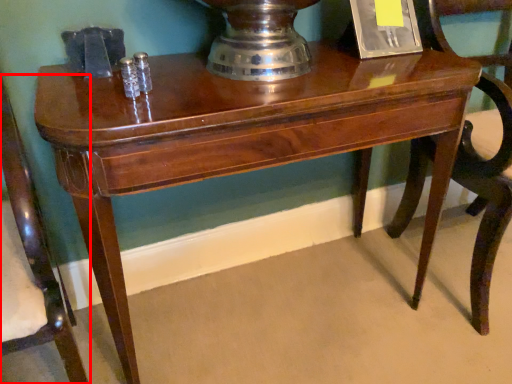
Question: Where is chair (annotated by the red box) located in relation to chair in the image?

Choices:
 (A) left
 (B) right

Answer: (A)